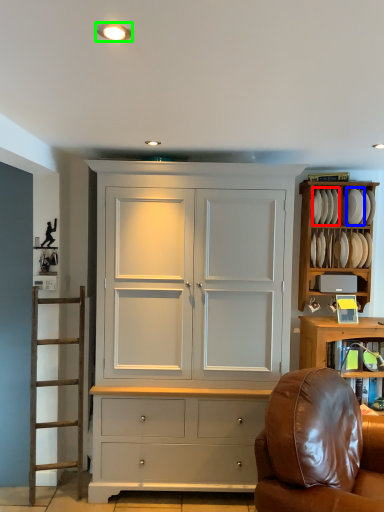
Question: Estimate the real-world distances between objects in this image. Which object is farther from plate (highlighted by a red box), plate (highlighted by a blue box) or lighting (highlighted by a green box)?

Choices:
 (A) plate
 (B) lighting

Answer: (B)